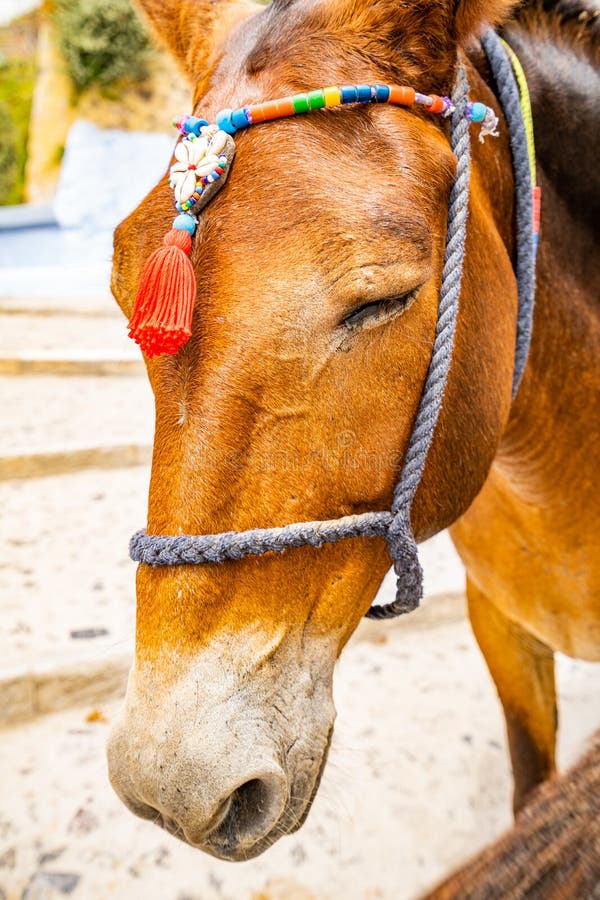
Find the location of `wood post`. wood post is located at coordinates (541, 847).